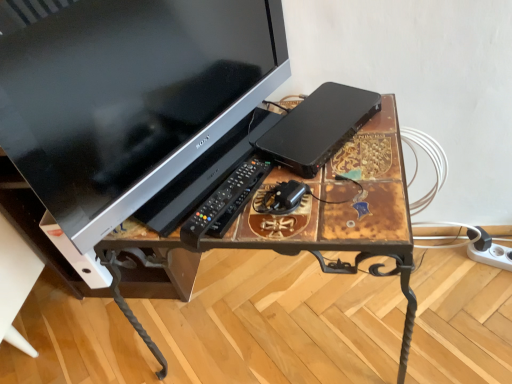
Locate an element on the screen. This screenshot has width=512, height=384. free location in front of black plastic power adapter at center is located at coordinates click(315, 229).